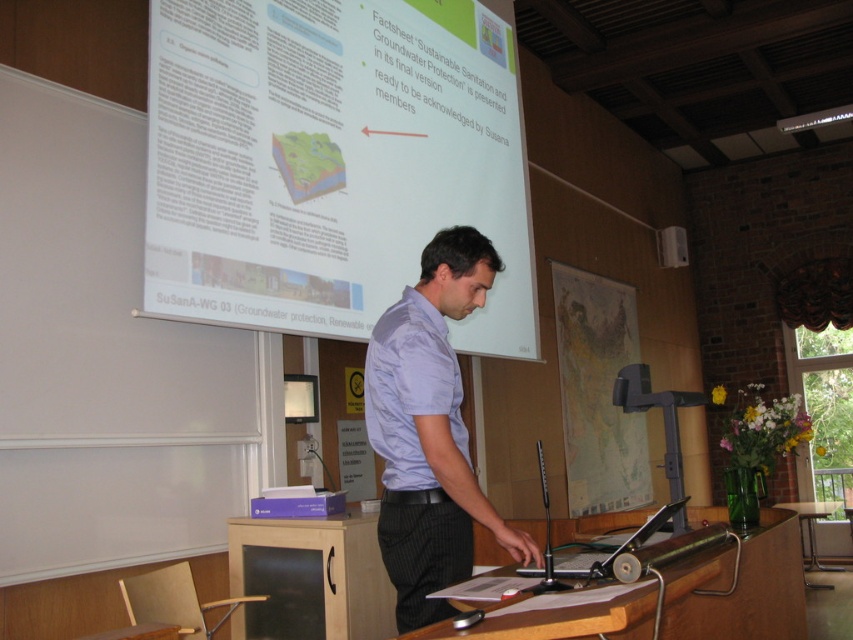
Does light blue shirt at center have a lesser height compared to wooden cabinet at lower center?

Incorrect, light blue shirt at center's height does not fall short of wooden cabinet at lower center's.

Between light blue shirt at center and wooden cabinet at lower center, which one has more height?

Standing taller between the two is light blue shirt at center.

Measure the distance between point (413, 532) and camera.

A distance of 2.08 meters exists between point (413, 532) and camera.

In order to click on light blue shirt at center in this screenshot , I will do `click(430, 432)`.

From the picture: Is light blue shirt at center shorter than wooden at center?

Incorrect, light blue shirt at center's height does not fall short of wooden at center's.

Is point (471, 561) behind point (775, 540)?

No, it is not.

Where is `light blue shirt at center`? This screenshot has width=853, height=640. light blue shirt at center is located at coordinates (430, 432).

Is wooden cabinet at lower center smaller than light blue cotton shirt at center?

Actually, wooden cabinet at lower center might be larger than light blue cotton shirt at center.

Between wooden cabinet at lower center and light blue cotton shirt at center, which one appears on the right side from the viewer's perspective?

Positioned to the right is light blue cotton shirt at center.

Between point (265, 621) and point (370, 436), which one is positioned in front?

Point (370, 436)

Locate an element on the screen. wooden cabinet at lower center is located at coordinates (309, 579).